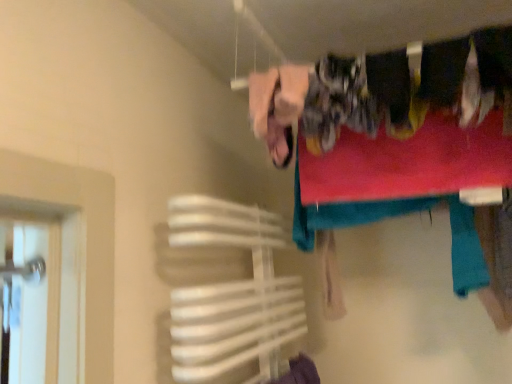
Question: Should I look upward or downward to see white plastic towel rack at lower left?

Choices:
 (A) up
 (B) down

Answer: (B)